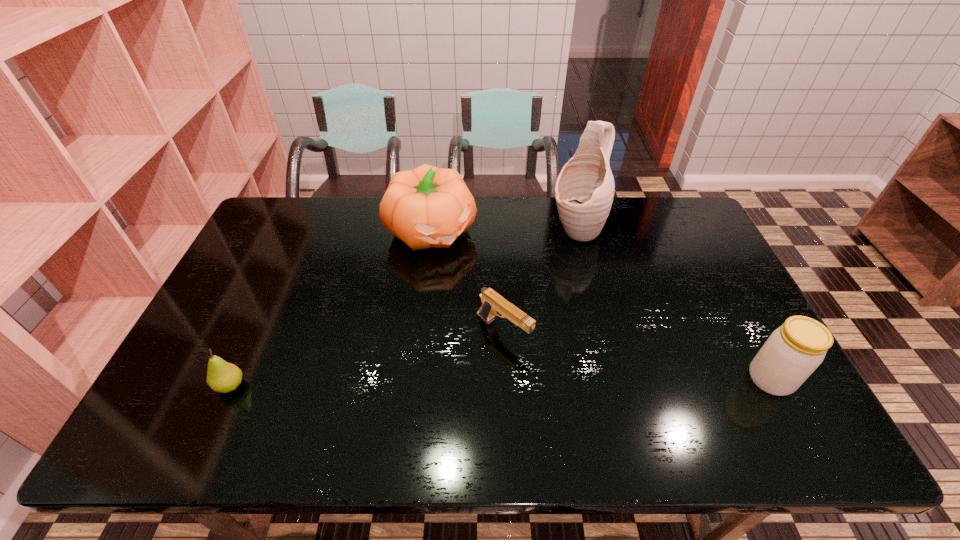
Locate an element on the screen. The width and height of the screenshot is (960, 540). pumpkin at the far edge is located at coordinates (425, 207).

At what (x,y) coordinates should I click in order to perform the action: click on pitcher that is at the far edge. Please return your answer as a coordinate pair (x, y). The width and height of the screenshot is (960, 540). Looking at the image, I should click on (584, 190).

Where is `pear present at the near edge`? The height and width of the screenshot is (540, 960). pear present at the near edge is located at coordinates (222, 376).

The image size is (960, 540). I want to click on jar situated at the near edge, so click(793, 351).

You are a GUI agent. You are given a task and a screenshot of the screen. Output one action in this format:
    pyautogui.click(x=<x>, y=<y>)
    Task: Click on the object situated at the left edge
    This screenshot has width=960, height=540.
    Given the screenshot: What is the action you would take?
    pyautogui.click(x=222, y=376)

Locate an element on the screen. object that is at the right edge is located at coordinates (793, 351).

The width and height of the screenshot is (960, 540). I want to click on object that is at the near left corner, so click(222, 376).

Locate an element on the screen. object at the near right corner is located at coordinates (793, 351).

Locate an element on the screen. The height and width of the screenshot is (540, 960). vacant area at the far edge of the desktop is located at coordinates (628, 219).

The image size is (960, 540). Find the location of `vacant space at the near edge of the desktop`. vacant space at the near edge of the desktop is located at coordinates (484, 382).